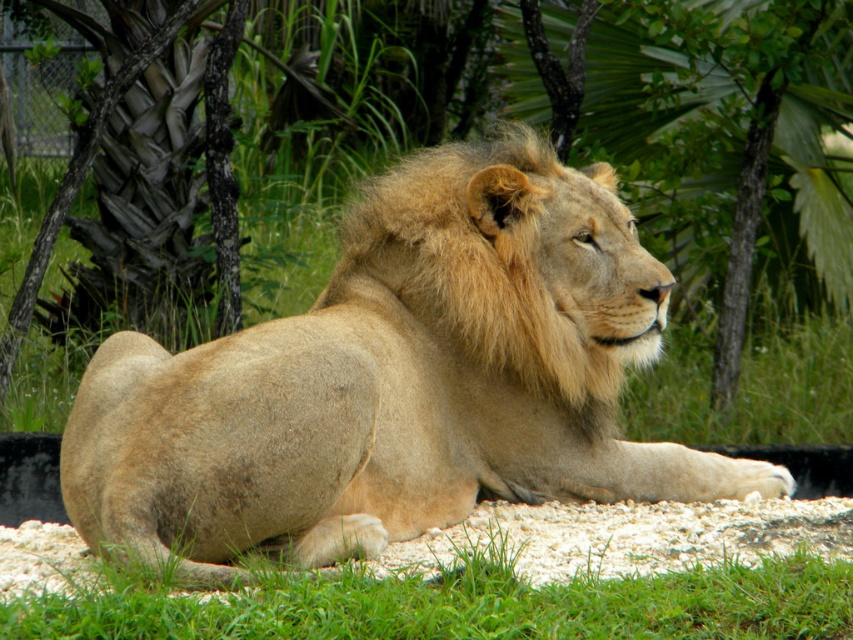
Describe the element at coordinates (398, 381) in the screenshot. I see `golden fur lion at center` at that location.

Is golden fur lion at center taller than green grass at lower center?

Yes.

Between point (572, 204) and point (664, 605), which one is positioned in front?

Point (664, 605)

Locate an element on the screen. This screenshot has height=640, width=853. golden fur lion at center is located at coordinates (398, 381).